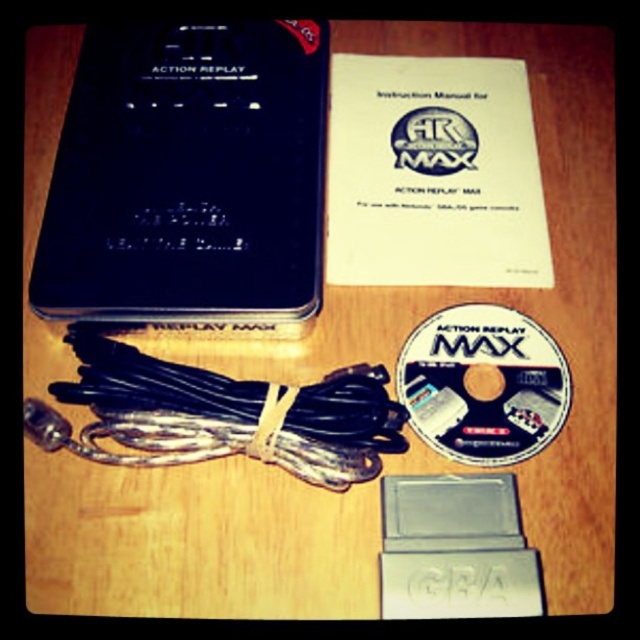
I want to click on black matte action replay max at upper left, so click(188, 177).

Does point (160, 65) lie in front of point (461, 426)?

No, (160, 65) is behind (461, 426).

Locate an element on the screen. Image resolution: width=640 pixels, height=640 pixels. black matte action replay max at upper left is located at coordinates (188, 177).